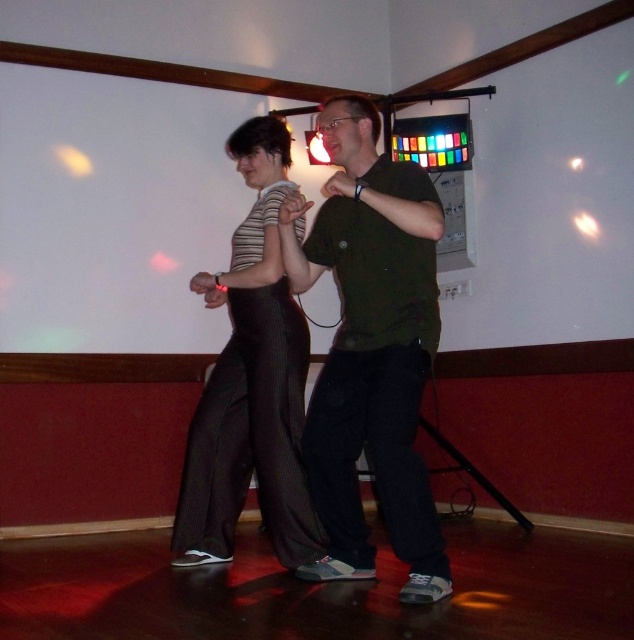
Between green matte shirt at center and striped fabric pants at center, which one has less height?

green matte shirt at center is shorter.

Can you confirm if green matte shirt at center is positioned below striped fabric pants at center?

Correct, green matte shirt at center is located below striped fabric pants at center.

Locate an element on the screen. green matte shirt at center is located at coordinates (370, 349).

Locate an element on the screen. This screenshot has height=640, width=634. green matte shirt at center is located at coordinates (370, 349).